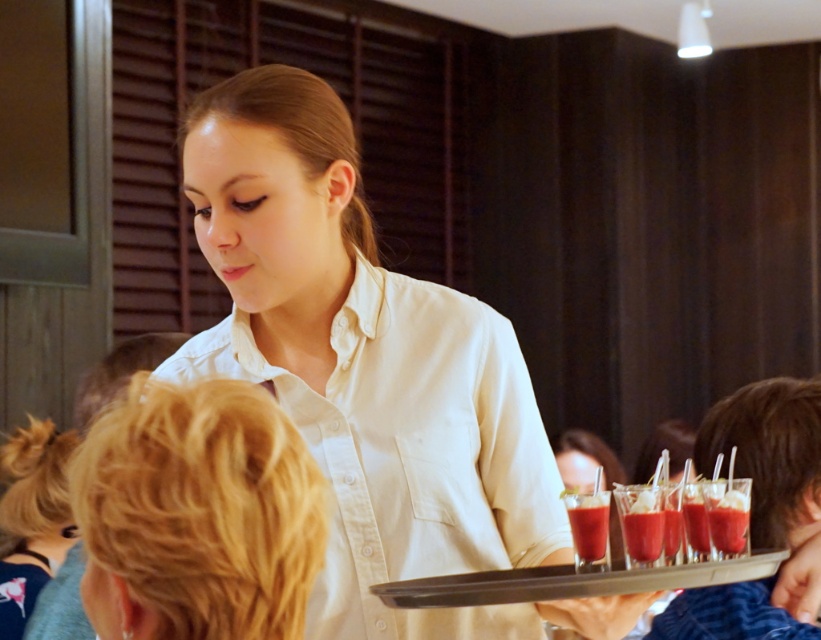
You are a photographer standing at a specific spot in the restaurant. You want to take a photo of the white cotton shirt at center. If your camera has a minimum focusing distance of 3 feet, will you be able to take a clear photo?

The white cotton shirt at center and camera are 4.00 feet apart from each other, so yes, the photographer can take a clear photo since the distance is within the camera minimum focusing distance of 3 feet.

You are standing in the restaurant and need to reach a point that is exactly 1.42 meters away from your current position. The point is labeled as point (301, 224). Can you confirm if this point is within your reach?

The distance of point (301, 224) from the camera is 1.42 meters, so yes, the point is within reach as it is exactly at the required distance.

You are a server in a restaurant and you see two guests with blonde hair at upper left and blonde hair at lower left. Which guest is sitting to the right of the other?

The blonde hair at upper left is positioned on the right side of blonde hair at lower left, so the guest with blonde hair at upper left is sitting to the right of the other guest with blonde hair at lower left.